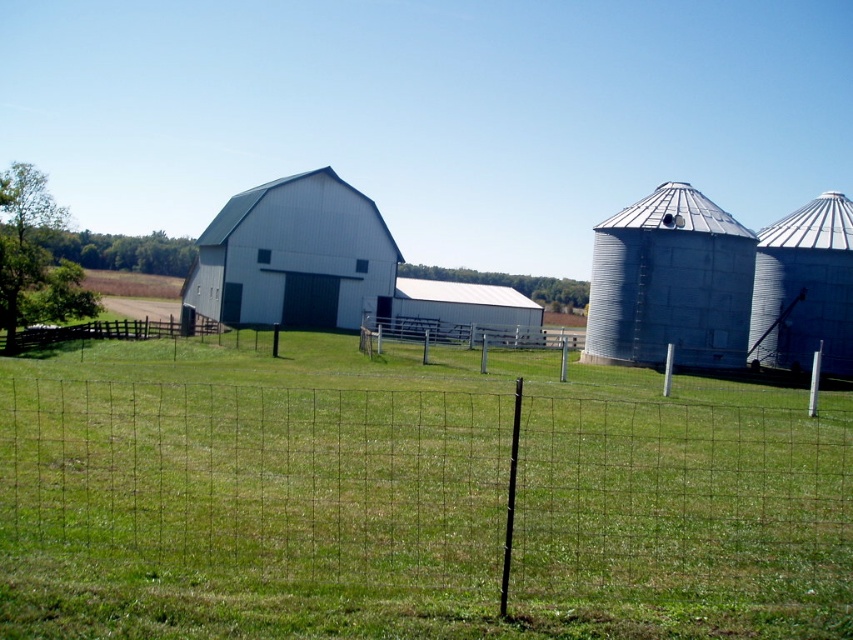
You are a farmer planning to install a new fence post between the white wood barn at center and the wire mesh fence at lower left. Given their relative sizes, which object will require more space to accommodate the post installation? Please explain your reasoning based on their dimensions.

The white wood barn at center requires more space for the post installation because its width is larger than the wire mesh fence at lower left, meaning it occupies a greater area and may necessitate more room to avoid structural interference.

You are a farmer standing at the wire mesh fence at lower left looking towards the white wood barn at center. Which object is higher in your line of sight?

The white wood barn at center is higher in your line of sight than the wire mesh fence at lower left because it is positioned above it.

In the scene shown: You are standing at the center of the field and looking towards the silver metallic silo at right and the wire mesh fence at lower left. Which object is higher from the ground?

The silver metallic silo at right is above the wire mesh fence at lower left, so the silver metallic silo at right is higher from the ground.